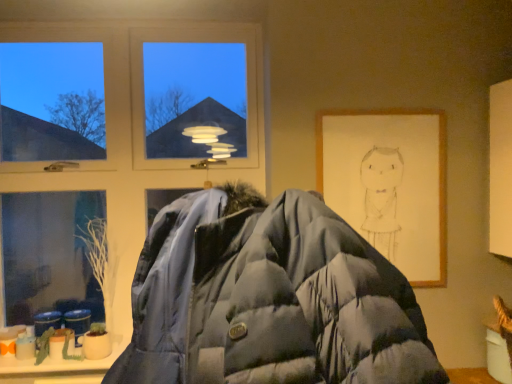
Question: Are wooden framed drawing at right and transparent glass window at upper left beside each other?

Choices:
 (A) yes
 (B) no

Answer: (B)

Question: From the image's perspective, is wooden framed drawing at right located above transparent glass window at upper left?

Choices:
 (A) yes
 (B) no

Answer: (B)

Question: Is wooden framed drawing at right bigger than transparent glass window at upper left?

Choices:
 (A) yes
 (B) no

Answer: (B)

Question: From a real-world perspective, is wooden framed drawing at right physically above transparent glass window at upper left?

Choices:
 (A) no
 (B) yes

Answer: (A)

Question: Does wooden framed drawing at right have a greater height compared to transparent glass window at upper left?

Choices:
 (A) yes
 (B) no

Answer: (B)

Question: Relative to matte blue puffer jacket at center, is transparent glass window at upper left in front or behind?

Choices:
 (A) behind
 (B) front

Answer: (A)

Question: Considering the relative positions of transparent glass window at upper left and matte blue puffer jacket at center in the image provided, is transparent glass window at upper left to the left or to the right of matte blue puffer jacket at center?

Choices:
 (A) left
 (B) right

Answer: (A)

Question: Considering the positions of transparent glass window at upper left and matte blue puffer jacket at center in the image, is transparent glass window at upper left taller or shorter than matte blue puffer jacket at center?

Choices:
 (A) tall
 (B) short

Answer: (A)

Question: From a real-world perspective, relative to matte blue puffer jacket at center, is transparent glass window at upper left vertically above or below?

Choices:
 (A) above
 (B) below

Answer: (A)

Question: Considering their positions, is wooden framed drawing at right located in front of or behind transparent glass window at upper left?

Choices:
 (A) behind
 (B) front

Answer: (B)

Question: Is point (394, 145) positioned closer to the camera than point (138, 187)?

Choices:
 (A) closer
 (B) farther

Answer: (A)

Question: From a real-world perspective, is wooden framed drawing at right physically located above or below transparent glass window at upper left?

Choices:
 (A) above
 (B) below

Answer: (B)

Question: From the image's perspective, is wooden framed drawing at right positioned above or below transparent glass window at upper left?

Choices:
 (A) below
 (B) above

Answer: (A)

Question: Based on their positions, is matte blue puffer jacket at center located to the left or right of transparent glass window at upper left?

Choices:
 (A) left
 (B) right

Answer: (B)

Question: From a real-world perspective, relative to transparent glass window at upper left, is matte blue puffer jacket at center vertically above or below?

Choices:
 (A) below
 (B) above

Answer: (A)